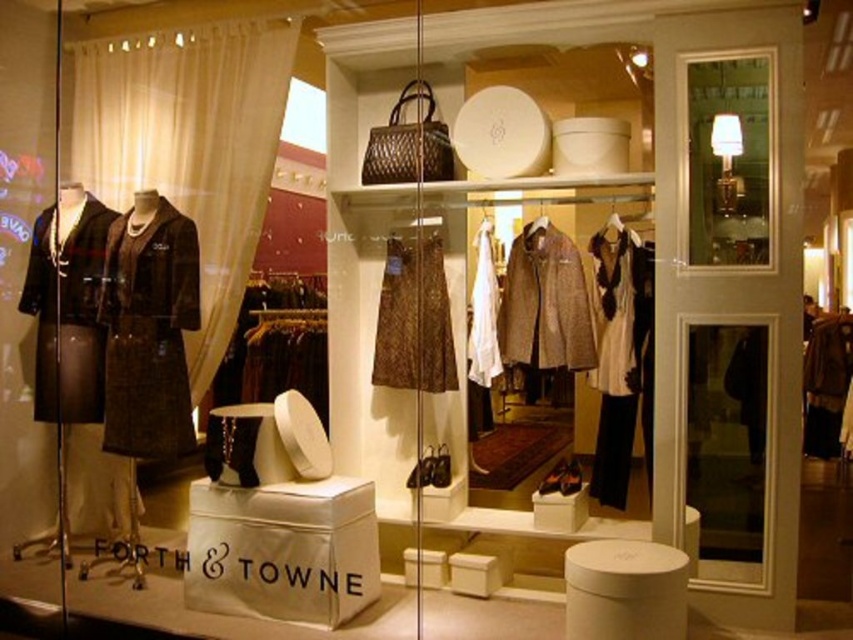
Who is more forward, (399, 332) or (828, 358)?

Point (828, 358) is in front.

The width and height of the screenshot is (853, 640). I want to click on brown textured dress at center, so click(x=415, y=321).

Locate an element on the screen. This screenshot has height=640, width=853. brown textured dress at center is located at coordinates (415, 321).

Identify the location of brown textured dress at center. (415, 321).

Is point (157, 236) in front of point (827, 396)?

No, (157, 236) is behind (827, 396).

Is brown textured coat at left shorter than velvet brown coat at center?

No.

Which is behind, point (164, 458) or point (814, 358)?

The point (164, 458) is behind.

Locate an element on the screen. brown textured coat at left is located at coordinates (149, 330).

The width and height of the screenshot is (853, 640). What are the coordinates of `matte brown coat at left` in the screenshot? It's located at (67, 310).

The width and height of the screenshot is (853, 640). Describe the element at coordinates (67, 310) in the screenshot. I see `matte brown coat at left` at that location.

Identify the location of matte brown coat at left. The image size is (853, 640). (67, 310).